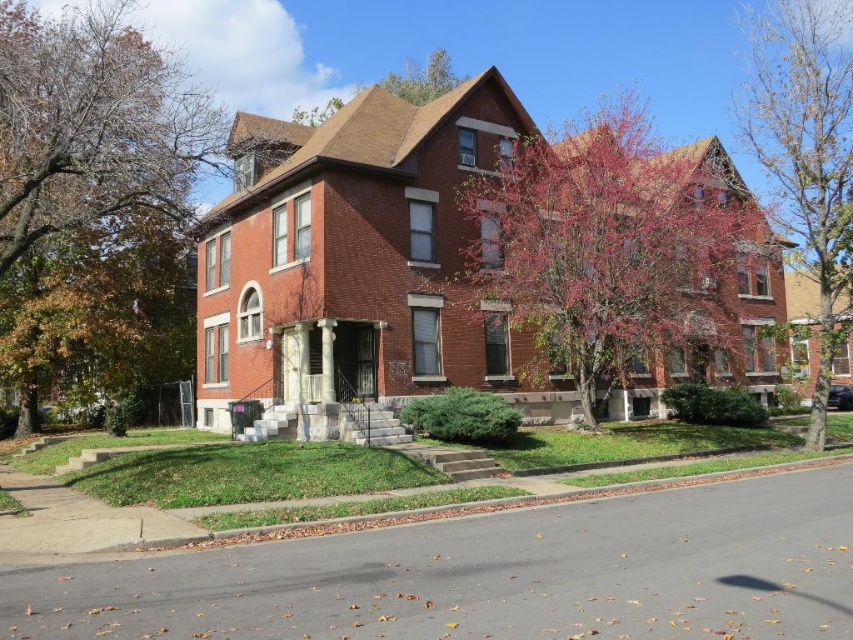
Question: Does reddish-brown bark tree at center have a greater width compared to smooth bark tree at right?

Choices:
 (A) no
 (B) yes

Answer: (A)

Question: Which point is farther from the camera taking this photo?

Choices:
 (A) (392, 83)
 (B) (71, 182)

Answer: (A)

Question: Does smooth bark tree at right have a greater width compared to green leafy tree at upper center?

Choices:
 (A) no
 (B) yes

Answer: (B)

Question: Which is farther from the brown textured tree at upper left?

Choices:
 (A) green leafy tree at upper center
 (B) smooth bark tree at right
 (C) reddish-brown bark tree at center

Answer: (B)

Question: Estimate the real-world distances between objects in this image. Which object is closer to the smooth bark tree at right?

Choices:
 (A) reddish-brown bark tree at center
 (B) green leafy tree at upper center
 (C) brown textured tree at upper left

Answer: (A)

Question: Does brown textured tree at upper left appear over green leafy tree at upper center?

Choices:
 (A) no
 (B) yes

Answer: (A)